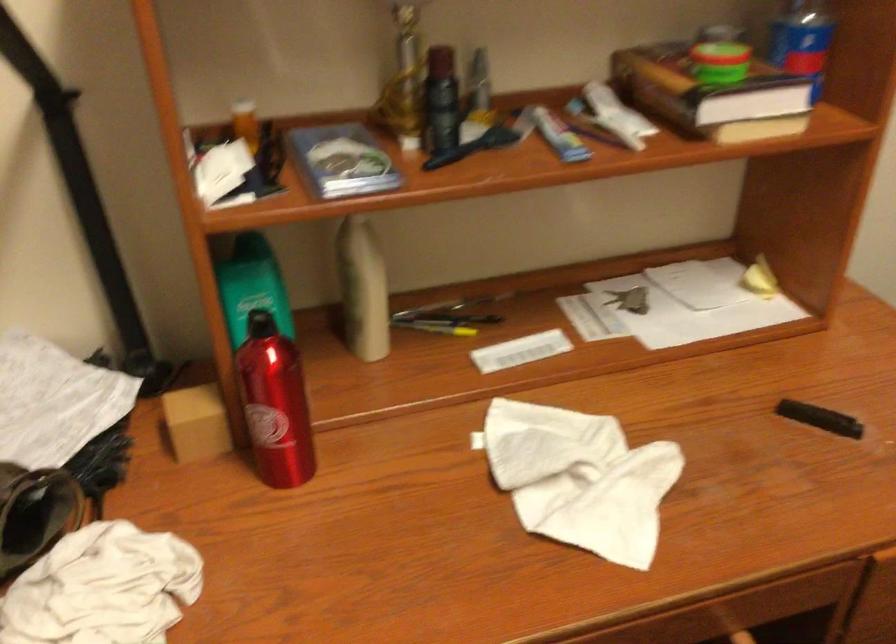
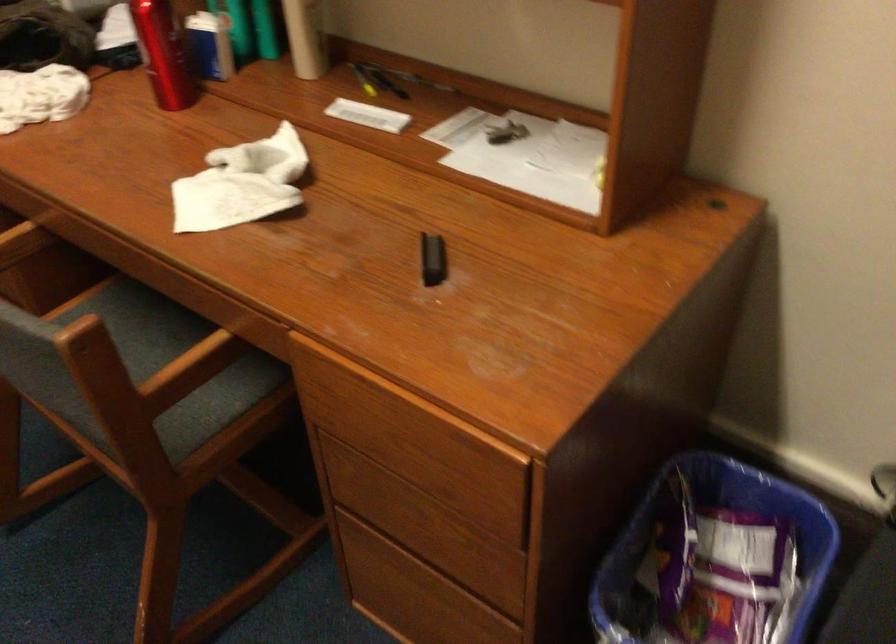
In the second image, find the point that corresponds to pixel 819 421 in the first image.

(433, 259)